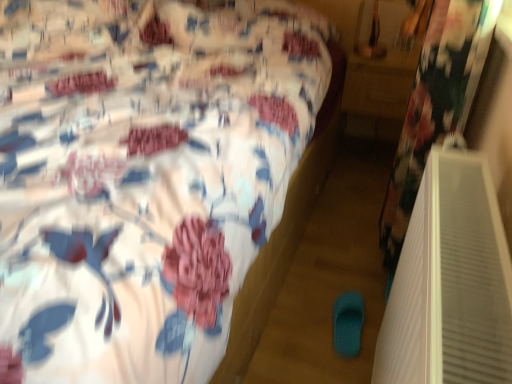
Question: Can you confirm if floral fabric bed at center is wider than teal rubber slipper at lower center?

Choices:
 (A) yes
 (B) no

Answer: (A)

Question: Is floral fabric bed at center bigger than teal rubber slipper at lower center?

Choices:
 (A) yes
 (B) no

Answer: (A)

Question: From a real-world perspective, is floral fabric bed at center on top of teal rubber slipper at lower center?

Choices:
 (A) yes
 (B) no

Answer: (A)

Question: Does floral fabric bed at center lie behind teal rubber slipper at lower center?

Choices:
 (A) yes
 (B) no

Answer: (B)

Question: Considering the relative sizes of floral fabric bed at center and teal rubber slipper at lower center in the image provided, is floral fabric bed at center shorter than teal rubber slipper at lower center?

Choices:
 (A) no
 (B) yes

Answer: (A)

Question: Does floral fabric bed at center come in front of teal rubber slipper at lower center?

Choices:
 (A) yes
 (B) no

Answer: (A)

Question: From a real-world perspective, is wooden table at right positioned over floral fabric bed at center based on gravity?

Choices:
 (A) no
 (B) yes

Answer: (A)

Question: Is wooden table at right behind floral fabric bed at center?

Choices:
 (A) yes
 (B) no

Answer: (A)

Question: Is wooden table at right taller than floral fabric bed at center?

Choices:
 (A) no
 (B) yes

Answer: (A)

Question: Can you confirm if wooden table at right is shorter than floral fabric bed at center?

Choices:
 (A) yes
 (B) no

Answer: (A)

Question: Is wooden table at right thinner than floral fabric bed at center?

Choices:
 (A) no
 (B) yes

Answer: (B)

Question: Is wooden table at right with floral fabric bed at center?

Choices:
 (A) yes
 (B) no

Answer: (B)

Question: Is teal rubber slipper at lower center bigger than wooden table at right?

Choices:
 (A) yes
 (B) no

Answer: (B)